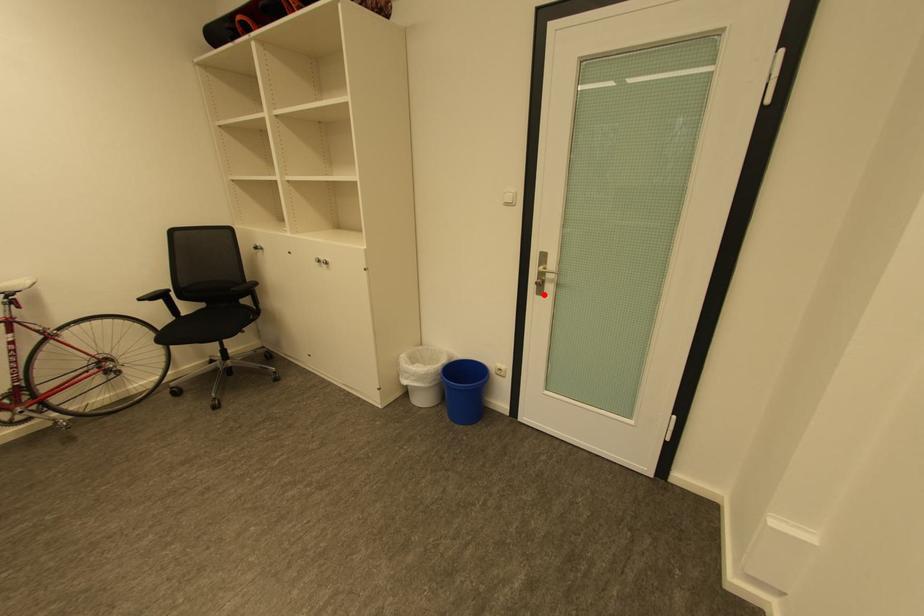
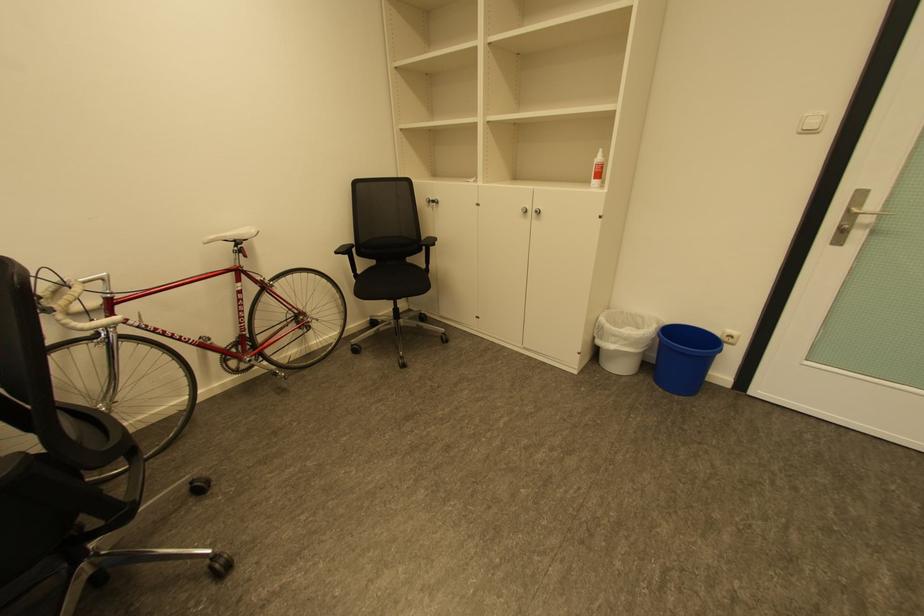
The point at the highlighted location is marked in the first image. Where is the corresponding point in the second image?

(837, 245)